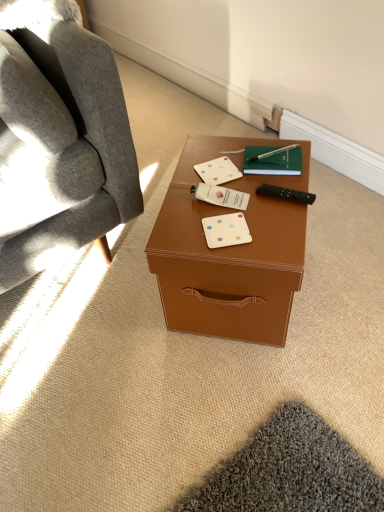
Question: Which direction should I rotate to face white matte business card at center, marked as the 2th business card in a back-to-front arrangement, — up or down?

Choices:
 (A) down
 (B) up

Answer: (B)

Question: Can you confirm if brown leather desk at center is bigger than white matte business card at center, which is counted as the first business card, starting from the bottom?

Choices:
 (A) no
 (B) yes

Answer: (B)

Question: From a real-world perspective, does brown leather desk at center stand above white matte business card at center, the 1th business card viewed from the front?

Choices:
 (A) no
 (B) yes

Answer: (A)

Question: Considering the relative positions of brown leather desk at center and white matte business card at center, the 3th business card when ordered from back to front, in the image provided, is brown leather desk at center behind white matte business card at center, the 3th business card when ordered from back to front,?

Choices:
 (A) yes
 (B) no

Answer: (B)

Question: Is brown leather desk at center oriented away from white matte business card at center, which is counted as the first business card, starting from the bottom?

Choices:
 (A) no
 (B) yes

Answer: (A)

Question: Does brown leather desk at center have a lesser height compared to white matte business card at center, the 1th business card viewed from the front?

Choices:
 (A) no
 (B) yes

Answer: (A)

Question: Does brown leather desk at center have a greater width compared to white matte business card at center, placed as the third business card when sorted from top to bottom?

Choices:
 (A) no
 (B) yes

Answer: (B)

Question: Does white matte business card at center, the 3th business card viewed from the front, have a greater width compared to white matte business card at center, positioned as the second business card in front-to-back order?

Choices:
 (A) no
 (B) yes

Answer: (B)

Question: Is white matte business card at center, which ranks as the first business card in back-to-front order, at the left side of white matte business card at center, marked as the 2th business card in a back-to-front arrangement?

Choices:
 (A) no
 (B) yes

Answer: (B)

Question: Can you confirm if white matte business card at center, which ranks as the first business card in back-to-front order, is positioned to the right of white matte business card at center, marked as the 2th business card in a back-to-front arrangement?

Choices:
 (A) yes
 (B) no

Answer: (B)

Question: From a real-world perspective, is white matte business card at center, the 3th business card viewed from the front, positioned under white matte business card at center, marked as the 2th business card in a back-to-front arrangement, based on gravity?

Choices:
 (A) no
 (B) yes

Answer: (B)

Question: Does white matte business card at center, marked as the first business card in a top-to-bottom arrangement, have a lesser height compared to white matte business card at center, marked as the 2th business card in a back-to-front arrangement?

Choices:
 (A) no
 (B) yes

Answer: (B)

Question: Is white matte business card at center, marked as the third business card in a bottom-to-top arrangement, looking in the opposite direction of white matte business card at center, arranged as the second business card when ordered from the bottom?

Choices:
 (A) yes
 (B) no

Answer: (B)

Question: Does black plastic remote control at right appear on the left side of white matte business card at center, marked as the 2th business card in a back-to-front arrangement?

Choices:
 (A) no
 (B) yes

Answer: (A)